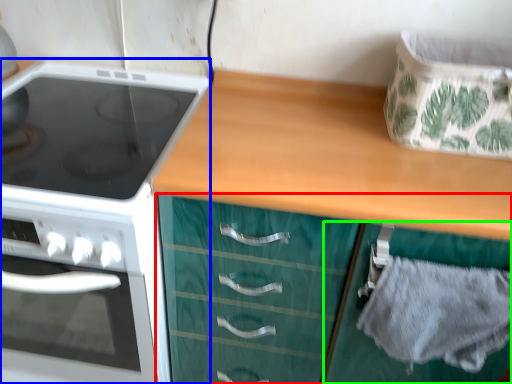
Question: Which object is the closest to the cabinetry (highlighted by a red box)? Choose among these: kitchen appliance (highlighted by a blue box) or cabinetry (highlighted by a green box).

Choices:
 (A) kitchen appliance
 (B) cabinetry

Answer: (B)